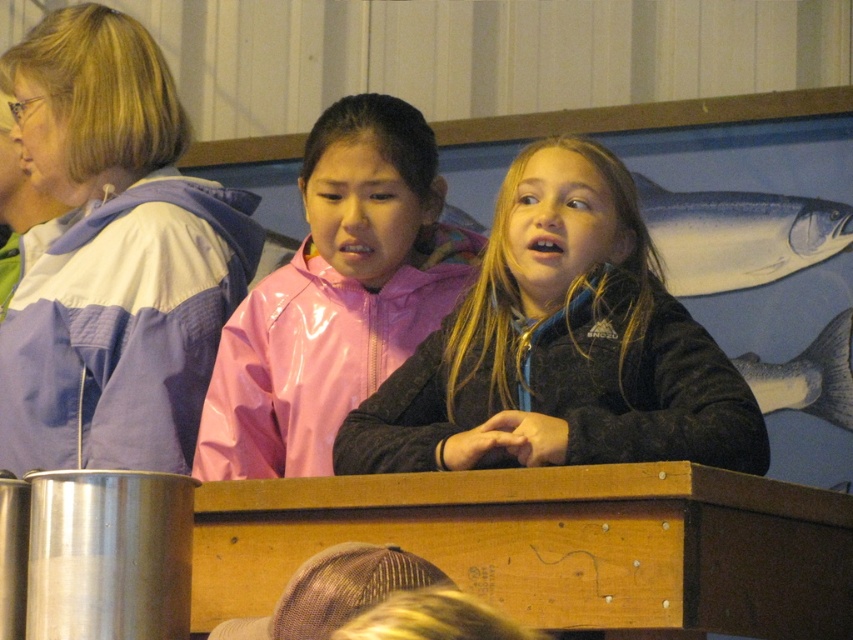
You are an artist trying to paint the mural behind the two girls. You need to place a new fish between the blue glossy fish at upper right and the shiny silver fish at upper right. Based on their current positions, where should you place the new fish to maintain the existing arrangement?

Result: The blue glossy fish at upper right is positioned on the left side of shiny silver fish at upper right. To maintain the existing arrangement, you should place the new fish between them, ensuring it is to the right of the blue glossy fish at upper right and to the left of the shiny silver fish at upper right.

You are trying to locate a specific point in the image. The point is at coordinates point (x=560, y=346). Which object is this point located on?

The point (x=560, y=346) is located on the matte black jacket at center.